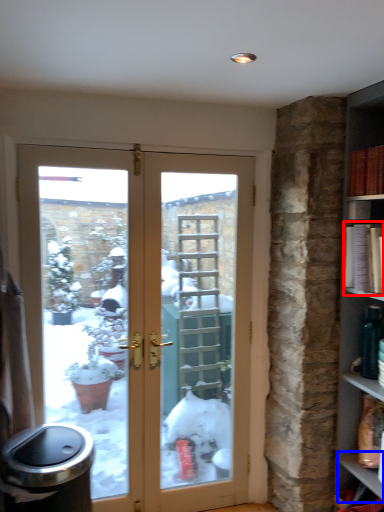
Question: Which object is further to the camera taking this photo, book (highlighted by a red box) or window sill (highlighted by a blue box)?

Choices:
 (A) book
 (B) window sill

Answer: (B)